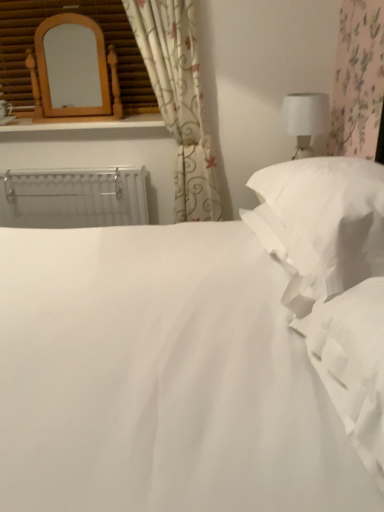
Image resolution: width=384 pixels, height=512 pixels. Find the location of `white fabric at right`. white fabric at right is located at coordinates (353, 364).

Describe the element at coordinates (323, 216) in the screenshot. I see `white soft pillow at right` at that location.

Find the location of a particular element. This screenshot has height=512, width=384. white matte table lamp at upper right is located at coordinates (305, 119).

Where is `floral fabric curtain at upper left`? Image resolution: width=384 pixels, height=512 pixels. floral fabric curtain at upper left is located at coordinates tap(179, 100).

What do you see at coordinates (179, 100) in the screenshot?
I see `floral fabric curtain at upper left` at bounding box center [179, 100].

At what (x,y) coordinates should I click in order to perform the action: click on white metallic radiator at left. Please return your answer as a coordinate pair (x, y). The height and width of the screenshot is (512, 384). Looking at the image, I should click on (73, 198).

Find the location of a particular element. The height and width of the screenshot is (512, 384). white fabric at right is located at coordinates (353, 364).

Is floral fabric curtain at upper left positioned with its back to white soft pillow at right?

No, floral fabric curtain at upper left is not facing away from white soft pillow at right.

Image resolution: width=384 pixels, height=512 pixels. I want to click on curtain that is on the left side of white soft pillow at right, so click(x=179, y=100).

Is there a large distance between floral fabric curtain at upper left and white soft pillow at right?

Yes, floral fabric curtain at upper left is far from white soft pillow at right.

Is white soft pillow at right facing towards white matte table lamp at upper right?

No, white soft pillow at right is not turned towards white matte table lamp at upper right.

How different are the orientations of white soft pillow at right and white matte table lamp at upper right in degrees?

The angular difference between white soft pillow at right and white matte table lamp at upper right is 4.36 degrees.

Between white soft pillow at right and white matte table lamp at upper right, which one has smaller size?

white matte table lamp at upper right is smaller.

Is white soft pillow at right taller than white matte table lamp at upper right?

No.

Considering the sizes of objects white smooth bed at center and white soft pillow at right in the image provided, who is bigger, white smooth bed at center or white soft pillow at right?

white smooth bed at center.

Measure the distance from white smooth bed at center to white soft pillow at right.

white smooth bed at center is 13.22 inches away from white soft pillow at right.

From a real-world perspective, which is physically above, white smooth bed at center or white soft pillow at right?

white smooth bed at center, from a real-world perspective.

Is point (268, 269) positioned after point (321, 219)?

That is True.

Considering the sizes of objects white matte table lamp at upper right and white soft pillow at right in the image provided, who is taller, white matte table lamp at upper right or white soft pillow at right?

With more height is white matte table lamp at upper right.

At what (x,y) coordinates should I click in order to perform the action: click on table lamp above the white soft pillow at right (from a real-world perspective). Please return your answer as a coordinate pair (x, y). The width and height of the screenshot is (384, 512). Looking at the image, I should click on (305, 119).

Relative to white soft pillow at right, is white matte table lamp at upper right in front or behind?

In the image, white matte table lamp at upper right appears behind white soft pillow at right.

Considering the positions of objects white matte table lamp at upper right and white soft pillow at right in the image provided, who is more to the right, white matte table lamp at upper right or white soft pillow at right?

Positioned to the right is white matte table lamp at upper right.

Is the surface of white metallic radiator at left in direct contact with white fabric at right?

No, white metallic radiator at left is not making contact with white fabric at right.

Which is behind, point (17, 203) or point (329, 317)?

The point (17, 203) is farther from the camera.

Which object is wider, white matte table lamp at upper right or white smooth bed at center?

Wider between the two is white smooth bed at center.

Based on the photo, which point is more distant from viewer, (310, 151) or (182, 388)?

The point (310, 151) is farther from the camera.

Can you confirm if white matte table lamp at upper right is bigger than white smooth bed at center?

No.

Is white matte table lamp at upper right positioned before white smooth bed at center?

No.

Considering the relative positions of white matte table lamp at upper right and floral fabric curtain at upper left in the image provided, is white matte table lamp at upper right to the right of floral fabric curtain at upper left from the viewer's perspective?

Indeed, white matte table lamp at upper right is positioned on the right side of floral fabric curtain at upper left.

Is white matte table lamp at upper right positioned with its back to floral fabric curtain at upper left?

white matte table lamp at upper right is not turned away from floral fabric curtain at upper left.

How different are the orientations of white matte table lamp at upper right and floral fabric curtain at upper left in degrees?

They differ by 90.9 degrees in their facing directions.

Locate an element on the screen. This screenshot has height=512, width=384. curtain on the left of white matte table lamp at upper right is located at coordinates (179, 100).

Where is `pillow in front of the floral fabric curtain at upper left`? This screenshot has height=512, width=384. pillow in front of the floral fabric curtain at upper left is located at coordinates (323, 216).

Image resolution: width=384 pixels, height=512 pixels. In order to click on pillow that appears below the white matte table lamp at upper right (from the image's perspective) in this screenshot , I will do `click(323, 216)`.

Based on their spatial positions, is white smooth bed at center or white matte table lamp at upper right further from white soft pillow at right?

white matte table lamp at upper right is positioned further to the anchor white soft pillow at right.

Estimate the real-world distances between objects in this image. Which object is further from white matte table lamp at upper right, white soft pillow at right or floral fabric curtain at upper left?

white soft pillow at right is positioned further to the anchor white matte table lamp at upper right.

From the image, which object appears to be farther from white smooth bed at center, wooden mirror at upper left or white soft pillow at right?

The object further to white smooth bed at center is wooden mirror at upper left.

When comparing their distances from white soft pillow at right, does white metallic radiator at left or white fabric at right seem closer?

Among the two, white fabric at right is located nearer to white soft pillow at right.

From the image, which object appears to be farther from wooden mirror at upper left, white metallic radiator at left or white smooth bed at center?

white smooth bed at center lies further to wooden mirror at upper left than the other object.

Estimate the real-world distances between objects in this image. Which object is further from white matte table lamp at upper right, floral fabric curtain at upper left or wooden mirror at upper left?

wooden mirror at upper left.

Which object lies nearer to the anchor point white soft pillow at right, white metallic radiator at left or white smooth bed at center?

white smooth bed at center is positioned closer to the anchor white soft pillow at right.

From the image, which object appears to be nearer to white metallic radiator at left, wooden mirror at upper left or white smooth bed at center?

wooden mirror at upper left is closer to white metallic radiator at left.

The image size is (384, 512). What are the coordinates of `sheet between white smooth bed at center and wooden mirror at upper left in the front-back direction` in the screenshot? It's located at (353, 364).

Where is `curtain between white fabric at right and white matte table lamp at upper right from front to back`? curtain between white fabric at right and white matte table lamp at upper right from front to back is located at coordinates (179, 100).

Where is `table lamp between white soft pillow at right and white metallic radiator at left along the z-axis`? This screenshot has width=384, height=512. table lamp between white soft pillow at right and white metallic radiator at left along the z-axis is located at coordinates (305, 119).

Locate an element on the screen. curtain positioned between white fabric at right and white metallic radiator at left from near to far is located at coordinates (179, 100).